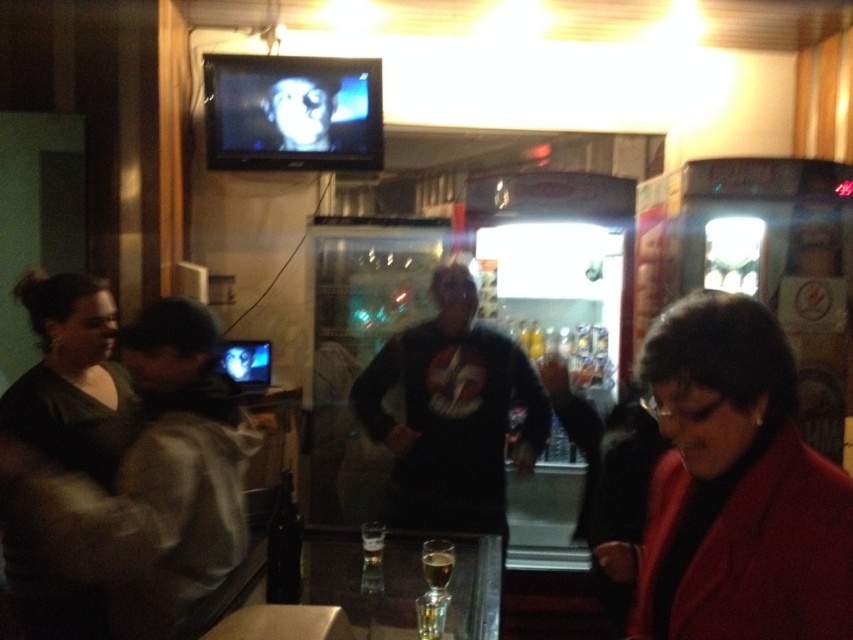
Is matte red coat at lower right above translucent glass beer at center?

Yes, matte red coat at lower right is above translucent glass beer at center.

Where is `matte red coat at lower right`? matte red coat at lower right is located at coordinates (737, 486).

Looking at this image, is matte red coat at lower right thinner than black matte sweatshirt at center?

Correct, matte red coat at lower right's width is less than black matte sweatshirt at center's.

Does matte red coat at lower right appear on the right side of black matte sweatshirt at center?

Correct, you'll find matte red coat at lower right to the right of black matte sweatshirt at center.

The height and width of the screenshot is (640, 853). Identify the location of matte red coat at lower right. (737, 486).

Based on the photo, can you confirm if matte black shirt at left is taller than translucent glass beer at center?

Yes.

Does point (119, 545) come behind point (437, 589)?

No, (119, 545) is closer to viewer.

Measure the distance between matte black shirt at left and camera.

matte black shirt at left and camera are 1.36 meters apart from each other.

At what (x,y) coordinates should I click in order to perform the action: click on matte black shirt at left. Please return your answer as a coordinate pair (x, y). The width and height of the screenshot is (853, 640). Looking at the image, I should click on (149, 481).